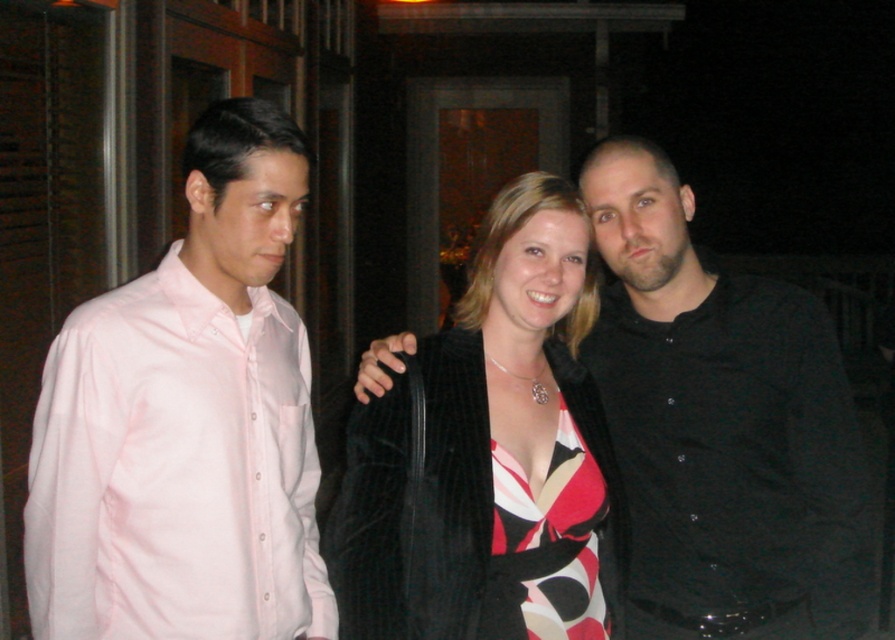
You are standing at the point with coordinates point (487, 454). What object are you standing on?

The point (487, 454) corresponds to the velvet black coat at center.

You are trying to decide which clothing item to take with you from the scene. The velvet black coat at center and the printed silk dress at center are both available. If you prefer something that takes up more space, which one should you choose?

The velvet black coat at center has a larger size compared to the printed silk dress at center, so you should choose the velvet black coat at center if you want something that takes up more space.

You are a photographer trying to capture a group photo of the pink satin shirt at left and the printed silk dress at center. Since you want to ensure both fit comfortably in the frame, which person should you position closer to the camera to maintain their relative sizes?

You should position the pink satin shirt at left closer to the camera because its width is greater than the printed silk dress at center, so moving it forward will help balance their sizes in the frame.